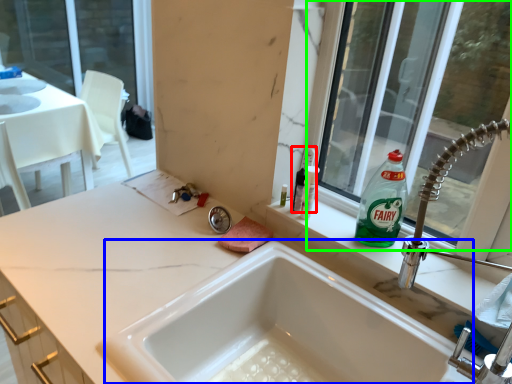
Question: Which object is positioned farthest from toiletry (highlighted by a red box)? Select from tub (highlighted by a blue box) and window (highlighted by a green box).

Choices:
 (A) tub
 (B) window

Answer: (B)